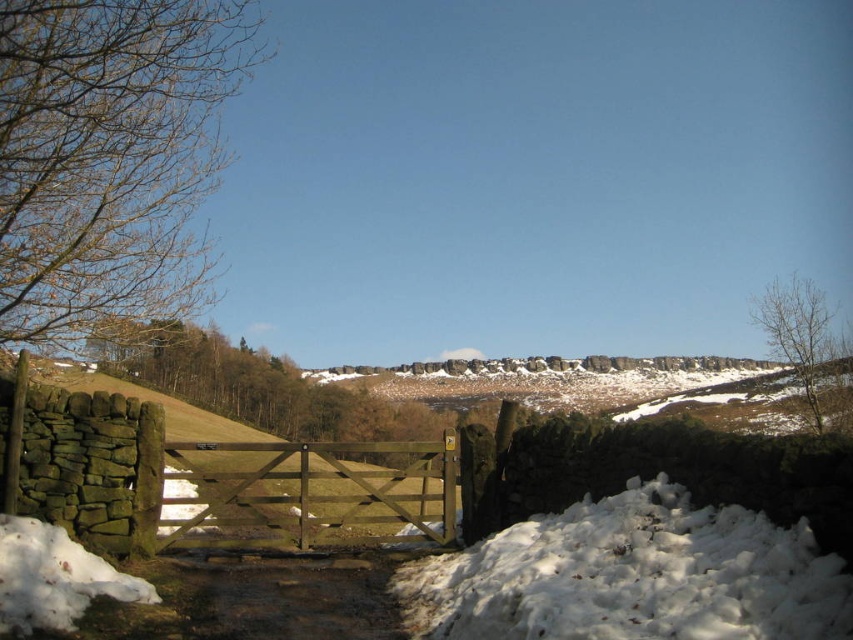
Question: Does bare branches at upper left appear over white fluffy snow at lower right?

Choices:
 (A) no
 (B) yes

Answer: (B)

Question: From the image, what is the correct spatial relationship of brown wooden gate at center in relation to bare wood tree at upper right?

Choices:
 (A) right
 (B) left

Answer: (B)

Question: Which point is farther from the camera taking this photo?

Choices:
 (A) (322, 536)
 (B) (57, 220)
 (C) (231, 353)

Answer: (C)

Question: Which point is closer to the camera taking this photo?

Choices:
 (A) pyautogui.click(x=120, y=342)
 (B) pyautogui.click(x=215, y=42)
 (C) pyautogui.click(x=82, y=557)
 (D) pyautogui.click(x=566, y=584)

Answer: (D)

Question: Which of the following is the closest to the observer?

Choices:
 (A) (38, 260)
 (B) (285, 420)
 (C) (811, 365)

Answer: (A)

Question: Does bare branches at upper left appear on the right side of white fluffy snow at lower left?

Choices:
 (A) yes
 (B) no

Answer: (B)